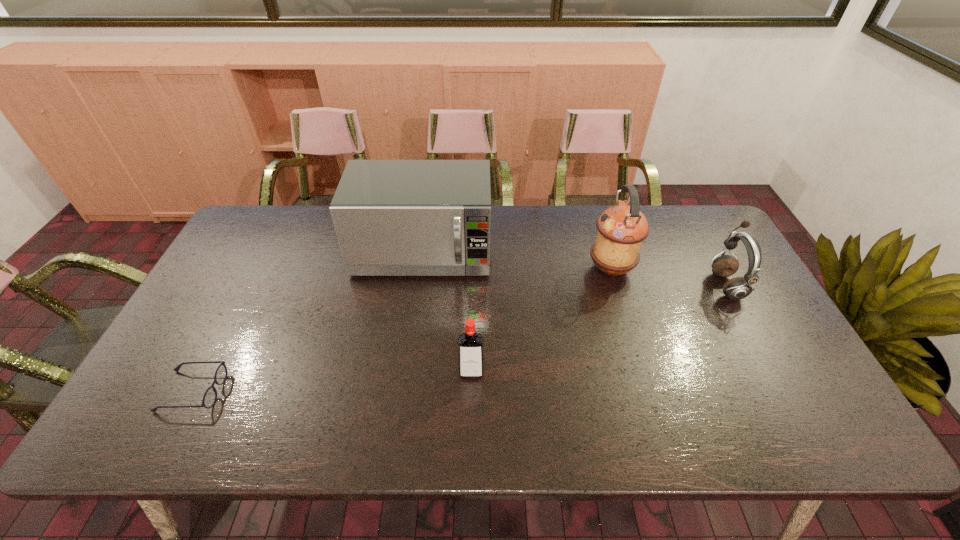
The height and width of the screenshot is (540, 960). I want to click on free spot at the left edge of the desktop, so click(203, 389).

Where is `free space between the second object from right to left and the leftmost object`? free space between the second object from right to left and the leftmost object is located at coordinates (401, 330).

Locate an element on the screen. This screenshot has height=540, width=960. vacant space in between the microwave oven and the rightmost object is located at coordinates (574, 269).

Locate an element on the screen. Image resolution: width=960 pixels, height=540 pixels. free space between the rightmost object and the second object from right to left is located at coordinates (668, 276).

Find the location of a particular element. vacant area that lies between the vodka and the earphone is located at coordinates (598, 328).

Image resolution: width=960 pixels, height=540 pixels. I want to click on empty space that is in between the rightmost object and the vodka, so click(x=598, y=328).

This screenshot has width=960, height=540. Identify the location of free space between the second object from right to left and the vodka. (541, 320).

Find the location of `vacant area between the vodka and the earphone`. vacant area between the vodka and the earphone is located at coordinates (598, 328).

Find the location of a particular element. The height and width of the screenshot is (540, 960). free spot between the shortest object and the vodka is located at coordinates (332, 382).

This screenshot has height=540, width=960. In order to click on unoccupied area between the leftmost object and the microwave oven in this screenshot , I will do `click(307, 322)`.